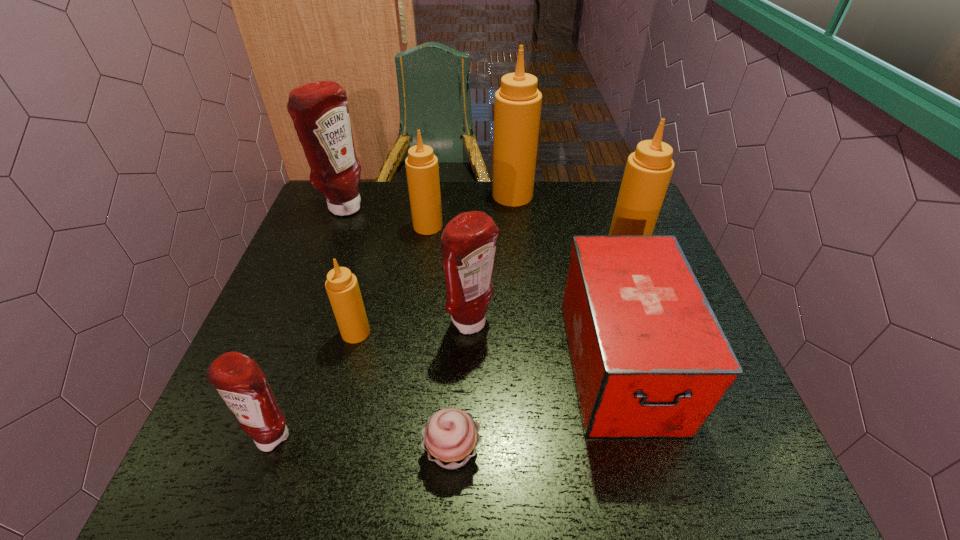
The width and height of the screenshot is (960, 540). I want to click on the tallest object, so click(517, 109).

The height and width of the screenshot is (540, 960). In order to click on the second condiment from right to left in this screenshot , I will do `click(517, 109)`.

In order to click on the biggest red condiment in this screenshot , I will do `click(319, 110)`.

You are a GUI agent. You are given a task and a screenshot of the screen. Output one action in this format:
    pyautogui.click(x=<x>, y=<y>)
    Task: Click on the rightmost tan condiment
    The width and height of the screenshot is (960, 540).
    Given the screenshot: What is the action you would take?
    pyautogui.click(x=648, y=171)

Image resolution: width=960 pixels, height=540 pixels. I want to click on the fourth nearest condiment, so click(648, 171).

Locate an element on the screen. Image resolution: width=960 pixels, height=540 pixels. the fourth object from left to right is located at coordinates (422, 170).

This screenshot has height=540, width=960. In order to click on the third tan condiment from right to left in this screenshot , I will do `click(422, 170)`.

The image size is (960, 540). I want to click on the rightmost red condiment, so click(x=468, y=244).

Locate an element on the screen. This screenshot has height=540, width=960. the third condiment from right to left is located at coordinates click(468, 244).

The height and width of the screenshot is (540, 960). Find the location of `the fifth condiment from right to left`. the fifth condiment from right to left is located at coordinates (342, 287).